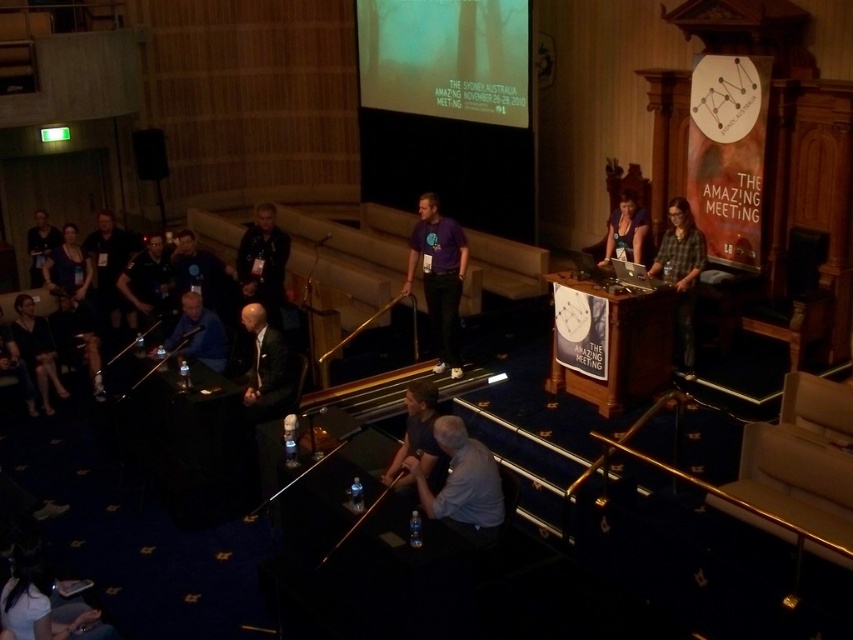
Where is the dark gray fabric shirt at lower center located in the image?

The dark gray fabric shirt at lower center is located at the point with coordinates 0.684 in the x dimension and 0.490 in the y dimension.

You are sitting in the audience and notice two speakers on stage. One is wearing a gray fabric shirt at lower center and the other a dark blue shirt at left. Which speaker is positioned closer to the center of the stage?

The gray fabric shirt at lower center is positioned closer to the center of the stage than the dark blue shirt at left.